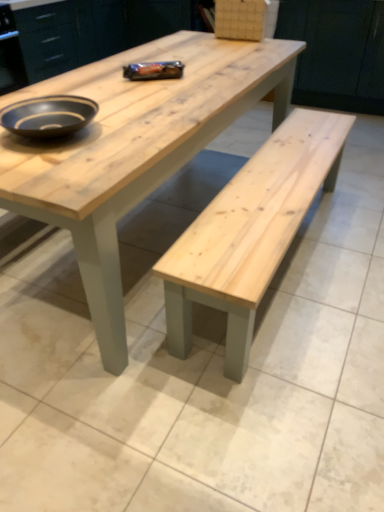
You are a GUI agent. You are given a task and a screenshot of the screen. Output one action in this format:
    pyautogui.click(x=<x>, y=<y>)
    Task: Click on the vacant space in matte black bowl at upper left (from a real-world perspective)
    
    Given the screenshot: What is the action you would take?
    pyautogui.click(x=66, y=132)